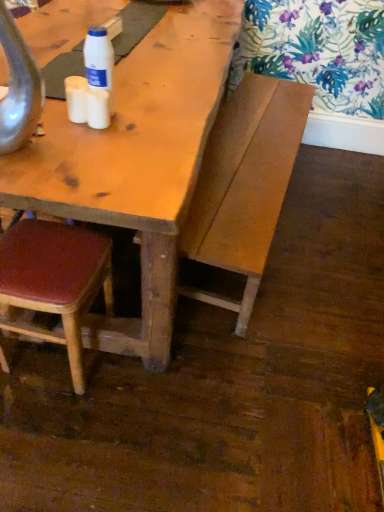
I want to click on wooden bench at center, so click(x=244, y=184).

This screenshot has width=384, height=512. Find the location of `white matte coffee cup at upper left, the second coffee cup positioned from the left`. white matte coffee cup at upper left, the second coffee cup positioned from the left is located at coordinates (98, 108).

Locate an element on the screen. Image resolution: width=384 pixels, height=512 pixels. white matte cup at center, placed as the first coffee cup when sorted from left to right is located at coordinates click(x=76, y=98).

Is wooden bench at center bigger or smaller than white matte cup at center, arranged as the second coffee cup when viewed from the right?

Clearly, wooden bench at center is larger in size than white matte cup at center, arranged as the second coffee cup when viewed from the right.

Is wooden bench at center facing away from white matte cup at center, placed as the first coffee cup when sorted from left to right?

No, wooden bench at center's orientation is not away from white matte cup at center, placed as the first coffee cup when sorted from left to right.

Considering the relative positions of wooden bench at center and white matte cup at center, arranged as the second coffee cup when viewed from the right, in the image provided, is wooden bench at center in front of white matte cup at center, arranged as the second coffee cup when viewed from the right,?

No, the depth of wooden bench at center is greater than that of white matte cup at center, arranged as the second coffee cup when viewed from the right.

Which object is wider, wooden bench at center or white matte cup at center, placed as the first coffee cup when sorted from left to right?

With larger width is wooden bench at center.

Is white plastic bottle at upper center oriented towards leatherette chair at lower left?

No, white plastic bottle at upper center is not turned towards leatherette chair at lower left.

Which object is positioned more to the right, white plastic bottle at upper center or leatherette chair at lower left?

Positioned to the right is white plastic bottle at upper center.

Which object is thinner, white plastic bottle at upper center or leatherette chair at lower left?

With smaller width is white plastic bottle at upper center.

Is white plastic bottle at upper center located outside leatherette chair at lower left?

Yes.

Is white matte coffee cup at upper left, the second coffee cup positioned from the left, behind leatherette chair at lower left?

No, it is not.

From a real-world perspective, is white matte coffee cup at upper left, arranged as the 1th coffee cup when viewed from the right, over leatherette chair at lower left?

Indeed, from a real-world perspective, white matte coffee cup at upper left, arranged as the 1th coffee cup when viewed from the right, stands above leatherette chair at lower left.

Which coffee cup is the 2nd one when counting from the right side of the leatherette chair at lower left? Please provide its 2D coordinates.

[(98, 108)]

From the picture: Which is correct: wooden bench at center is inside white matte coffee cup at upper left, the second coffee cup positioned from the left, or outside of it?

wooden bench at center is not enclosed by white matte coffee cup at upper left, the second coffee cup positioned from the left.

Is wooden bench at center closer to camera compared to white matte coffee cup at upper left, arranged as the 1th coffee cup when viewed from the right?

No, wooden bench at center is further to the viewer.

From the image's perspective, is wooden bench at center located above or below white matte coffee cup at upper left, the second coffee cup positioned from the left?

wooden bench at center is below white matte coffee cup at upper left, the second coffee cup positioned from the left.

Between wooden bench at center and white matte coffee cup at upper left, arranged as the 1th coffee cup when viewed from the right, which one appears on the left side from the viewer's perspective?

From the viewer's perspective, white matte coffee cup at upper left, arranged as the 1th coffee cup when viewed from the right, appears more on the left side.

Can you confirm if white matte coffee cup at upper left, the second coffee cup positioned from the left, is thinner than wooden bench at center?

Indeed, white matte coffee cup at upper left, the second coffee cup positioned from the left, has a lesser width compared to wooden bench at center.

Who is taller, white matte coffee cup at upper left, the second coffee cup positioned from the left, or wooden bench at center?

With more height is wooden bench at center.

What's the angular difference between white matte coffee cup at upper left, the second coffee cup positioned from the left, and wooden bench at center's facing directions?

There is a 94.1-degree angle between the facing directions of white matte coffee cup at upper left, the second coffee cup positioned from the left, and wooden bench at center.

From the picture: Is white matte cup at center, placed as the first coffee cup when sorted from left to right, bigger or smaller than wooden bench at center?

Considering their sizes, white matte cup at center, placed as the first coffee cup when sorted from left to right, takes up less space than wooden bench at center.

Is point (74, 112) closer to viewer compared to point (251, 114)?

Yes, point (74, 112) is in front of point (251, 114).

From the image's perspective, which is above, white matte cup at center, placed as the first coffee cup when sorted from left to right, or wooden bench at center?

white matte cup at center, placed as the first coffee cup when sorted from left to right, from the image's perspective.

Based on the photo, which of these two, white matte cup at center, arranged as the second coffee cup when viewed from the right, or wooden bench at center, stands shorter?

white matte cup at center, arranged as the second coffee cup when viewed from the right, is shorter.

Considering their positions, is white plastic bottle at upper center located in front of or behind white matte cup at center, placed as the first coffee cup when sorted from left to right?

A: Clearly, white plastic bottle at upper center is in front of white matte cup at center, placed as the first coffee cup when sorted from left to right.

Is white plastic bottle at upper center inside or outside of white matte cup at center, arranged as the second coffee cup when viewed from the right?

white plastic bottle at upper center is outside white matte cup at center, arranged as the second coffee cup when viewed from the right.

Does white plastic bottle at upper center have a smaller size compared to white matte cup at center, placed as the first coffee cup when sorted from left to right?

Incorrect, white plastic bottle at upper center is not smaller in size than white matte cup at center, placed as the first coffee cup when sorted from left to right.

From a real-world perspective, is white plastic bottle at upper center beneath white matte cup at center, arranged as the second coffee cup when viewed from the right?

No.

This screenshot has width=384, height=512. In order to click on coffee cup that is the 2nd one above the wooden bench at center (from a real-world perspective) in this screenshot , I will do `click(76, 98)`.

The width and height of the screenshot is (384, 512). What are the coordinates of `bottle that appears on the right of leatherette chair at lower left` in the screenshot? It's located at (98, 58).

Which object lies nearer to the anchor point wooden bench at center, white matte cup at center, placed as the first coffee cup when sorted from left to right, or white plastic bottle at upper center?

white plastic bottle at upper center lies closer to wooden bench at center than the other object.

Which object lies nearer to the anchor point wooden bench at center, leatherette chair at lower left or white matte coffee cup at upper left, arranged as the 1th coffee cup when viewed from the right?

leatherette chair at lower left is closer to wooden bench at center.

Considering their positions, is white plastic bottle at upper center positioned closer to wooden bench at center than white matte coffee cup at upper left, arranged as the 1th coffee cup when viewed from the right?

Based on the image, white plastic bottle at upper center appears to be nearer to wooden bench at center.

When comparing their distances from leatherette chair at lower left, does white matte cup at center, arranged as the second coffee cup when viewed from the right, or wooden bench at center seem further?

The object further to leatherette chair at lower left is wooden bench at center.

Estimate the real-world distances between objects in this image. Which object is closer to wooden bench at center, white matte coffee cup at upper left, the second coffee cup positioned from the left, or leatherette chair at lower left?

Based on the image, leatherette chair at lower left appears to be nearer to wooden bench at center.

From the picture: Considering their positions, is wooden bench at center positioned closer to white matte coffee cup at upper left, the second coffee cup positioned from the left, than white matte cup at center, placed as the first coffee cup when sorted from left to right?

white matte cup at center, placed as the first coffee cup when sorted from left to right, is positioned closer to the anchor white matte coffee cup at upper left, the second coffee cup positioned from the left.

Consider the image. Which object lies nearer to the anchor point leatherette chair at lower left, white plastic bottle at upper center or white matte coffee cup at upper left, arranged as the 1th coffee cup when viewed from the right?

Among the two, white matte coffee cup at upper left, arranged as the 1th coffee cup when viewed from the right, is located nearer to leatherette chair at lower left.

From the image, which object appears to be nearer to white matte cup at center, placed as the first coffee cup when sorted from left to right, leatherette chair at lower left or wooden bench at center?

leatherette chair at lower left lies closer to white matte cup at center, placed as the first coffee cup when sorted from left to right, than the other object.

The height and width of the screenshot is (512, 384). What are the coordinates of `bottle between leatherette chair at lower left and wooden bench at center in the horizontal direction` in the screenshot? It's located at (98, 58).

The image size is (384, 512). In order to click on coffee cup situated between white plastic bottle at upper center and wooden bench at center from left to right in this screenshot , I will do `click(98, 108)`.

The height and width of the screenshot is (512, 384). What are the coordinates of `coffee cup between white matte cup at center, placed as the first coffee cup when sorted from left to right, and leatherette chair at lower left vertically` in the screenshot? It's located at (98, 108).

Find the location of a particular element. coffee cup between white plastic bottle at upper center and white matte coffee cup at upper left, arranged as the 1th coffee cup when viewed from the right, in the up-down direction is located at coordinates (x=76, y=98).